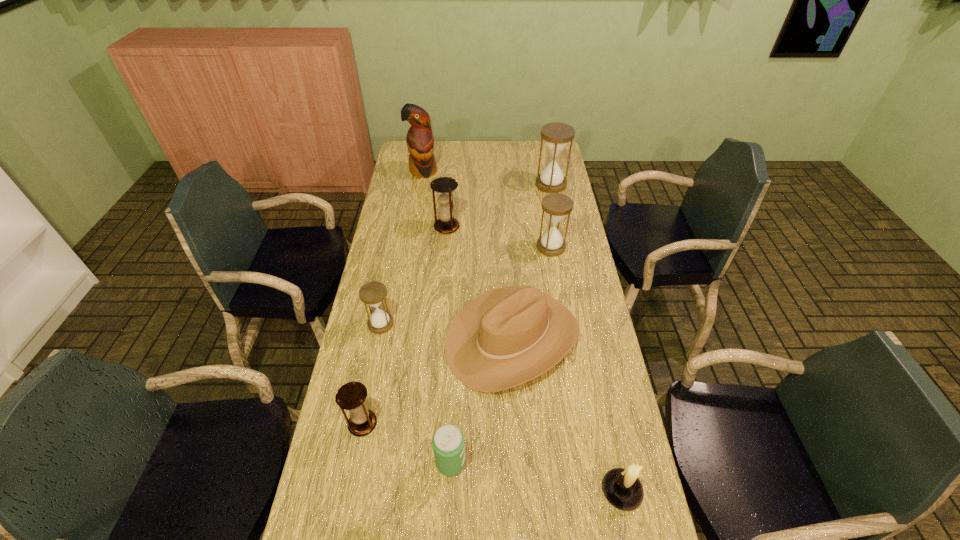
This screenshot has width=960, height=540. I want to click on parrot, so click(x=420, y=142).

At what (x,y) coordinates should I click in order to perform the action: click on red parrot. Please return your answer as a coordinate pair (x, y). Looking at the image, I should click on (420, 142).

In order to click on the farthest hourglass in this screenshot , I will do `click(556, 135)`.

This screenshot has height=540, width=960. I want to click on the second tallest object, so click(556, 135).

Image resolution: width=960 pixels, height=540 pixels. I want to click on the bigger brown hourglass, so click(x=444, y=186).

At what (x,y) coordinates should I click in order to perform the action: click on the right brown hourglass. Please return your answer as a coordinate pair (x, y). The width and height of the screenshot is (960, 540). Looking at the image, I should click on (444, 186).

Image resolution: width=960 pixels, height=540 pixels. In order to click on the second smallest white hourglass in this screenshot , I will do `click(556, 206)`.

At what (x,y) coordinates should I click in order to perform the action: click on the fourth farthest object. Please return your answer as a coordinate pair (x, y). The height and width of the screenshot is (540, 960). Looking at the image, I should click on (556, 206).

This screenshot has width=960, height=540. In order to click on cowboy hat in this screenshot , I will do tap(507, 336).

Image resolution: width=960 pixels, height=540 pixels. Identify the location of the leftmost white hourglass. (373, 293).